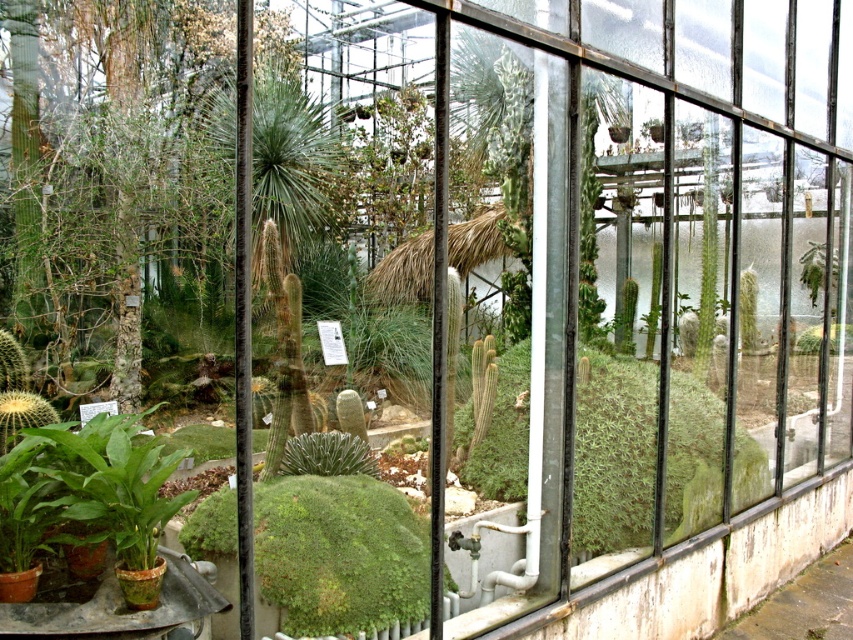
Question: Does green fuzzy cactus at center appear on the left side of green fuzzy cactus at right?

Choices:
 (A) yes
 (B) no

Answer: (A)

Question: Is green fuzzy cactus at center below green fuzzy cactus at right?

Choices:
 (A) no
 (B) yes

Answer: (B)

Question: Which point is farther from the camera taking this photo?

Choices:
 (A) (331, 470)
 (B) (817, 252)

Answer: (B)

Question: Observing the image, what is the correct spatial positioning of green fuzzy cactus at center in reference to green fuzzy cactus at right?

Choices:
 (A) above
 (B) below

Answer: (B)

Question: Which of the following is the closest to the observer?

Choices:
 (A) green fuzzy cactus at right
 (B) green fuzzy cactus at center

Answer: (B)